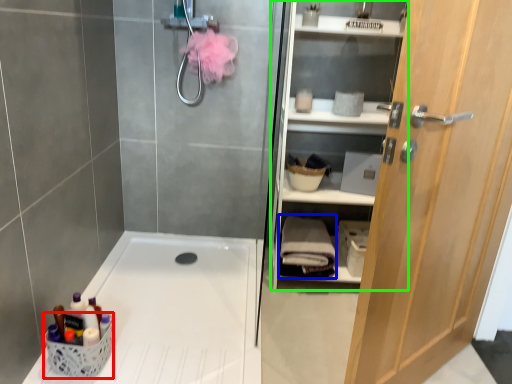
Question: Based on their relative distances, which object is farther from basket (highlighted by a red box)? Choose from bath towel (highlighted by a blue box) and shelf (highlighted by a green box).

Choices:
 (A) bath towel
 (B) shelf

Answer: (B)